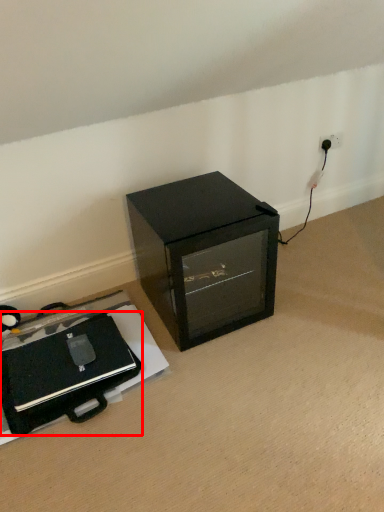
Question: Observing the image, what is the correct spatial positioning of wide (annotated by the red box) in reference to furniture?

Choices:
 (A) left
 (B) right

Answer: (A)